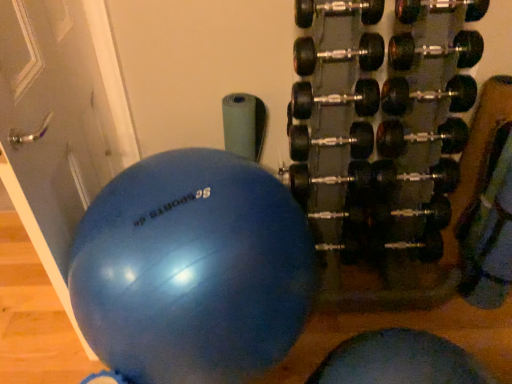
Question: Can you confirm if black rubber dumbbell at right is bigger than matte gray door at left?

Choices:
 (A) no
 (B) yes

Answer: (B)

Question: Is black rubber dumbbell at right closer to camera compared to matte gray door at left?

Choices:
 (A) no
 (B) yes

Answer: (A)

Question: From the image's perspective, is black rubber dumbbell at right below matte gray door at left?

Choices:
 (A) no
 (B) yes

Answer: (A)

Question: Considering the relative positions of black rubber dumbbell at right and matte gray door at left in the image provided, is black rubber dumbbell at right to the left of matte gray door at left from the viewer's perspective?

Choices:
 (A) yes
 (B) no

Answer: (B)

Question: Can matte gray door at left be found inside black rubber dumbbell at right?

Choices:
 (A) yes
 (B) no

Answer: (B)

Question: From a real-world perspective, is blue rubber ball at center positioned above or below matte gray door at left?

Choices:
 (A) above
 (B) below

Answer: (B)

Question: Based on their sizes in the image, would you say blue rubber ball at center is bigger or smaller than matte gray door at left?

Choices:
 (A) big
 (B) small

Answer: (A)

Question: From the image's perspective, is blue rubber ball at center positioned above or below matte gray door at left?

Choices:
 (A) above
 (B) below

Answer: (B)

Question: In the image, is blue rubber ball at center positioned in front of or behind matte gray door at left?

Choices:
 (A) front
 (B) behind

Answer: (B)

Question: From their relative heights in the image, would you say matte gray door at left is taller or shorter than black rubber dumbbell at right?

Choices:
 (A) tall
 (B) short

Answer: (A)

Question: From a real-world perspective, relative to black rubber dumbbell at right, is matte gray door at left vertically above or below?

Choices:
 (A) below
 (B) above

Answer: (B)

Question: Is matte gray door at left in front of or behind black rubber dumbbell at right in the image?

Choices:
 (A) behind
 (B) front

Answer: (B)

Question: Is matte gray door at left to the left or to the right of black rubber dumbbell at right in the image?

Choices:
 (A) right
 (B) left

Answer: (B)

Question: Considering the positions of blue rubber ball at center and black rubber dumbbell at right in the image, is blue rubber ball at center bigger or smaller than black rubber dumbbell at right?

Choices:
 (A) big
 (B) small

Answer: (B)

Question: Is point (278, 299) positioned closer to the camera than point (340, 39)?

Choices:
 (A) closer
 (B) farther

Answer: (A)